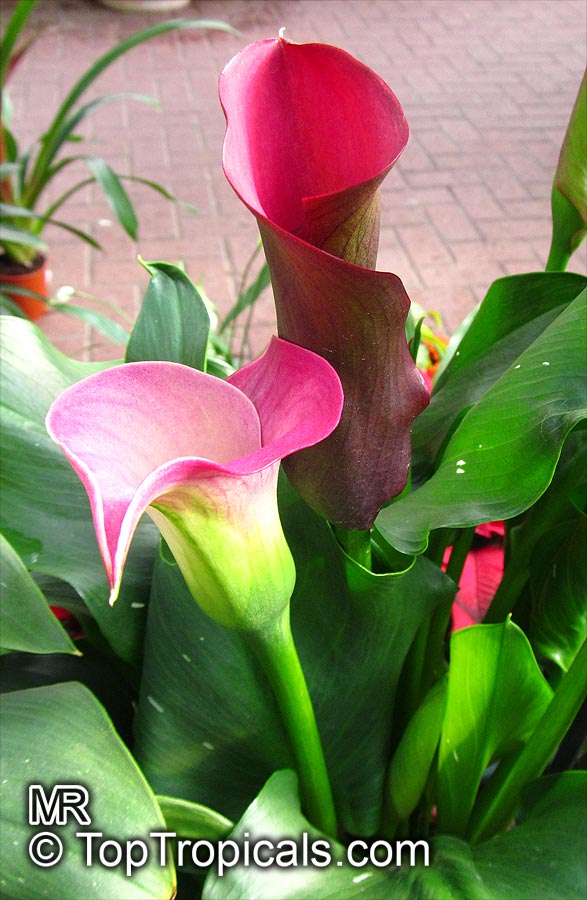
Where is `flower pot`? This screenshot has height=900, width=587. flower pot is located at coordinates [x=31, y=277].